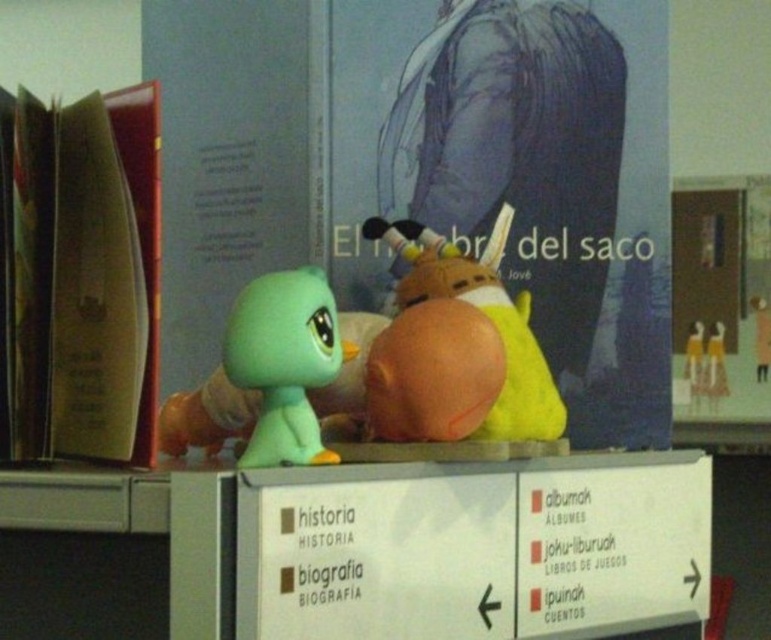
You are standing in front of a library shelf with various categories. You notice a point marked at coordinates (86, 276). Which object is this point located on?

The point at coordinates (86, 276) is located on the brown leather book at left.

You are organizing items on a library shelf. You have a brown leather book at left and a matte yellow plush at center. Which item is closer to you when standing in front of the shelf?

The brown leather book at left is closer to you because it is in front of the matte yellow plush at center.